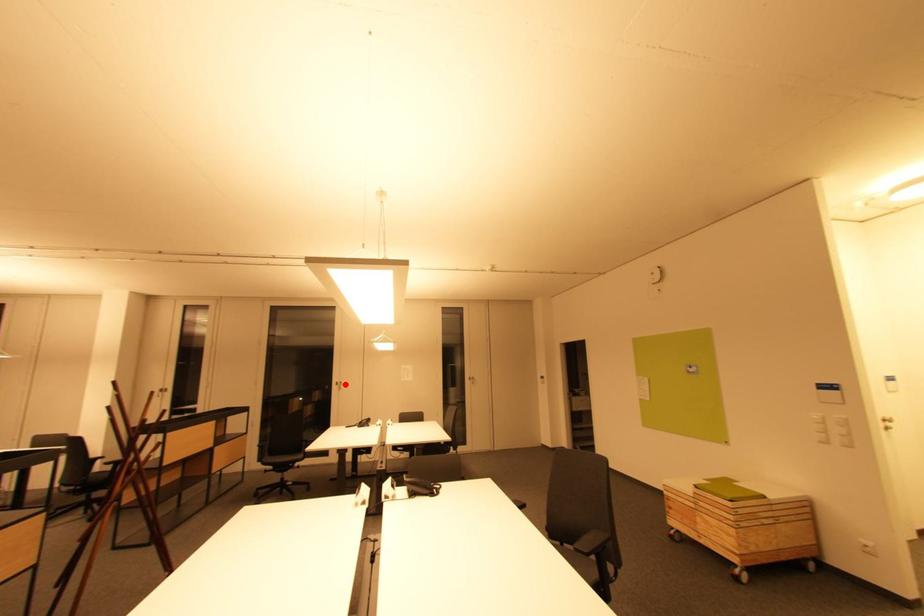
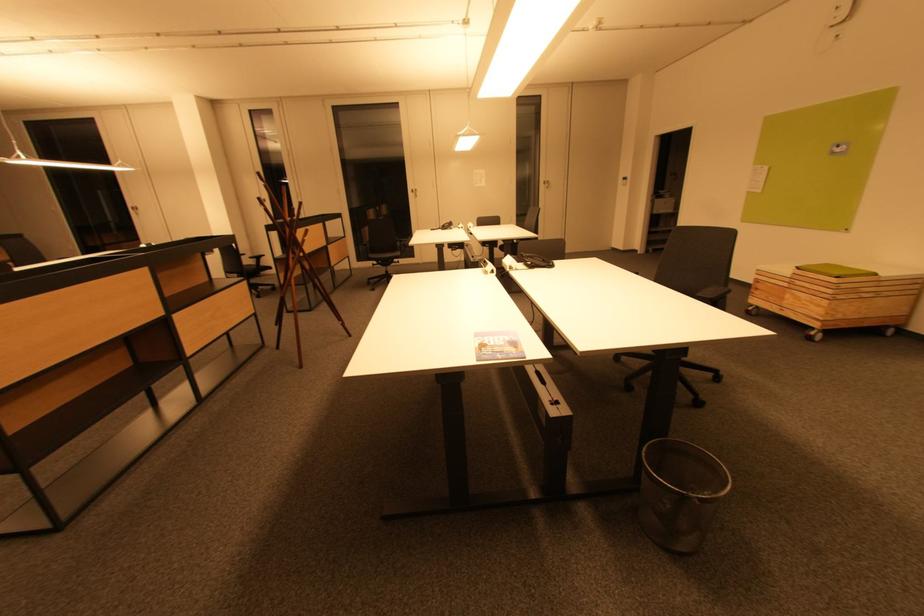
Where in the second image is the point corresponding to the highlighted location from the first image?

(419, 191)